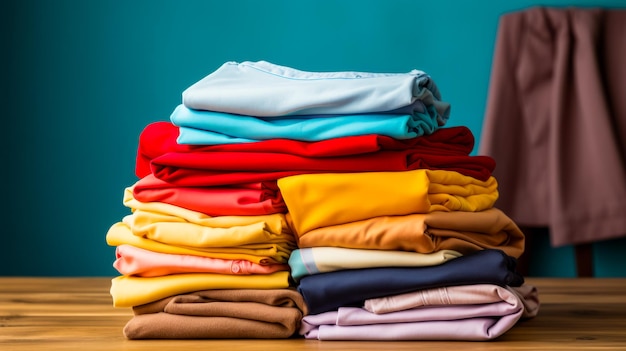
Identify the location of yellow folded pieces of fabric. (173, 209), (168, 225), (274, 245), (228, 255), (175, 284), (371, 185), (399, 233).